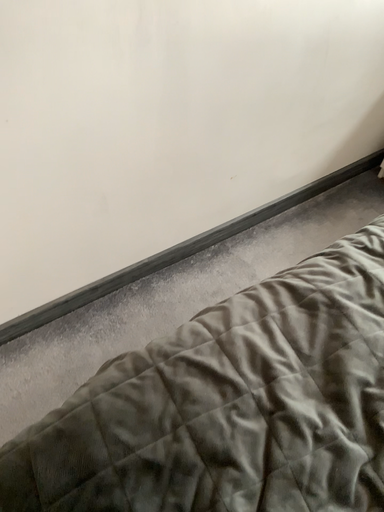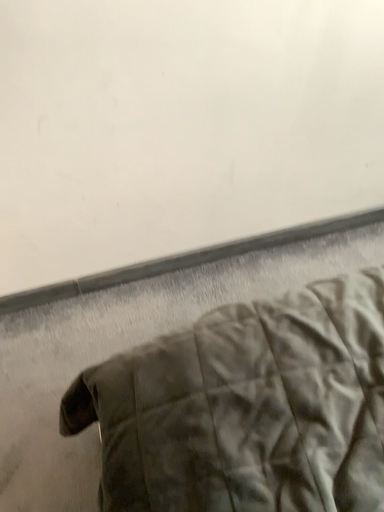
Question: How did the camera likely rotate when shooting the video?

Choices:
 (A) rotated left
 (B) rotated right

Answer: (A)